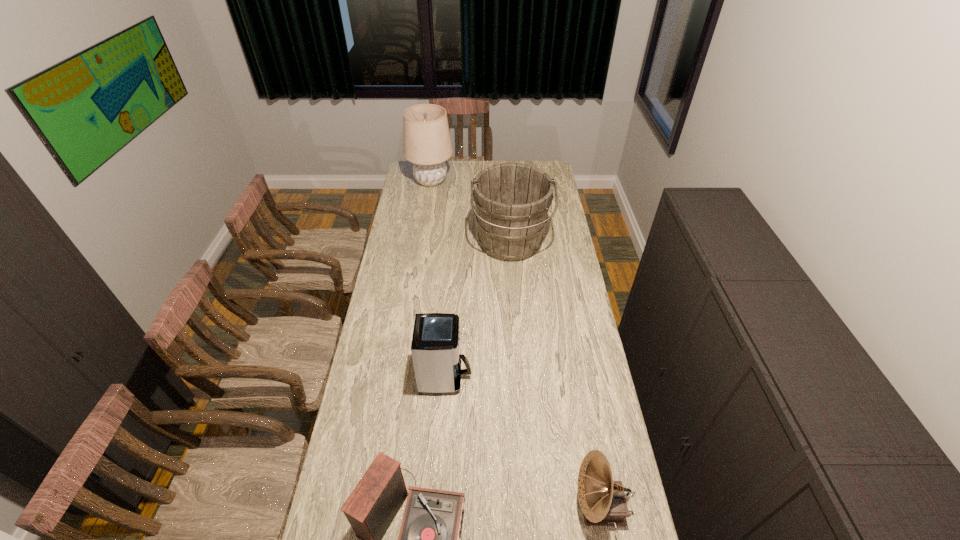
The width and height of the screenshot is (960, 540). I want to click on the farthest object, so click(x=427, y=144).

Where is `the second tallest object`? The image size is (960, 540). the second tallest object is located at coordinates (512, 200).

Where is `bucket`? bucket is located at coordinates (512, 200).

Where is `the third farthest object`? the third farthest object is located at coordinates (435, 344).

You are a GUI agent. You are given a task and a screenshot of the screen. Output one action in this format:
    pyautogui.click(x=<x>, y=<y>)
    Task: Click on the vacant space located on the right of the farthest object
    This screenshot has width=960, height=540.
    Given the screenshot: What is the action you would take?
    pyautogui.click(x=469, y=181)

The image size is (960, 540). In order to click on vacant space located on the handle side of the fourth nearest object in this screenshot , I will do `click(517, 335)`.

Where is `free space located on the front panel of the coffee maker`? free space located on the front panel of the coffee maker is located at coordinates (491, 377).

Where is `object that is at the far edge`? This screenshot has height=540, width=960. object that is at the far edge is located at coordinates (427, 144).

What are the coordinates of `object that is at the left edge` in the screenshot? It's located at (427, 144).

At what (x,y) coordinates should I click in order to perform the action: click on object positioned at the right edge. Please return your answer as a coordinate pair (x, y). The image size is (960, 540). Looking at the image, I should click on (512, 200).